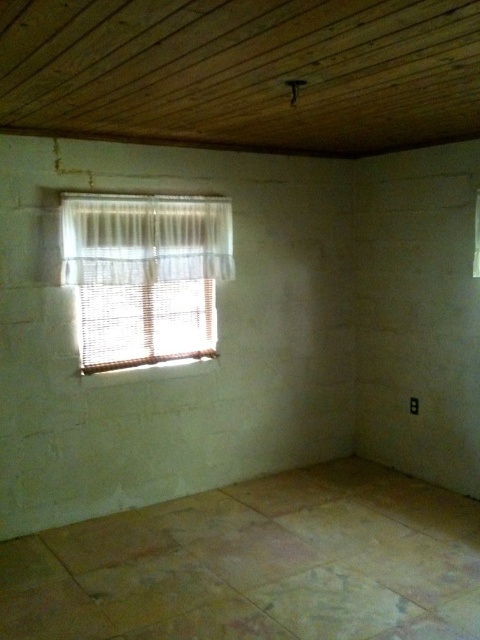
Question: Is white woven blinds at left further to camera compared to white sheer curtain at upper left?

Choices:
 (A) no
 (B) yes

Answer: (A)

Question: Can you confirm if white woven blinds at left is bigger than white sheer curtain at upper left?

Choices:
 (A) no
 (B) yes

Answer: (B)

Question: Which point appears closest to the camera in this image?

Choices:
 (A) (184, 216)
 (B) (99, 362)

Answer: (B)

Question: Is white woven blinds at left further to camera compared to white sheer curtain at upper left?

Choices:
 (A) no
 (B) yes

Answer: (A)